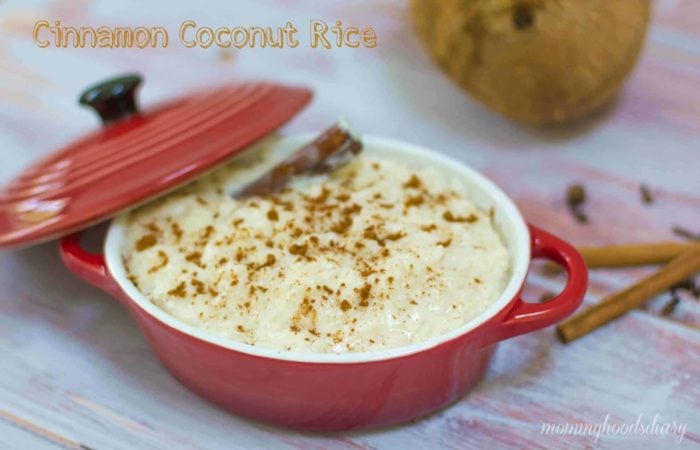
The height and width of the screenshot is (450, 700). What are the coordinates of `empty space bottom left of cup` in the screenshot? It's located at (78, 399).